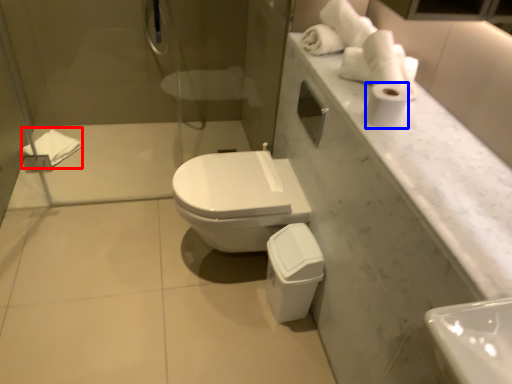
Question: Among these objects, which one is nearest to the camera, bath towel (highlighted by a red box) or toilet paper (highlighted by a blue box)?

Choices:
 (A) bath towel
 (B) toilet paper

Answer: (B)